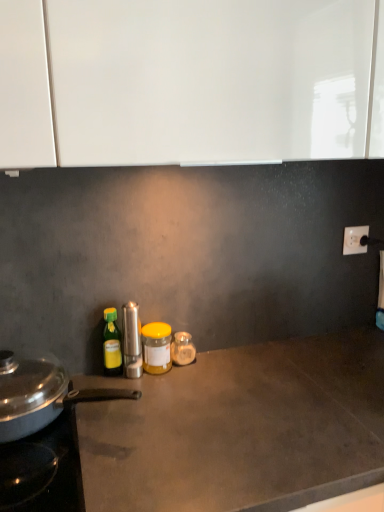
Where is `free point above matte gray countertop at center (from a real-world perspective)`? free point above matte gray countertop at center (from a real-world perspective) is located at coordinates (245, 401).